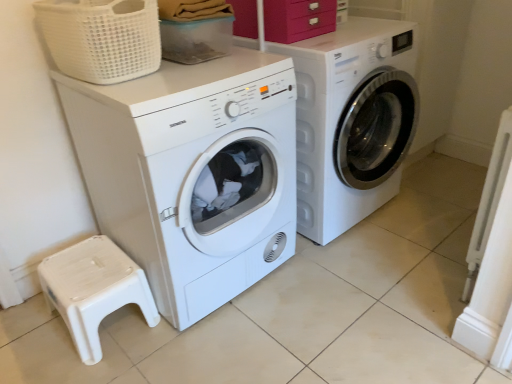
I want to click on vacant area in front of white matte washing machine at left, which ranks as the first washing machine in left-to-right order, so click(225, 350).